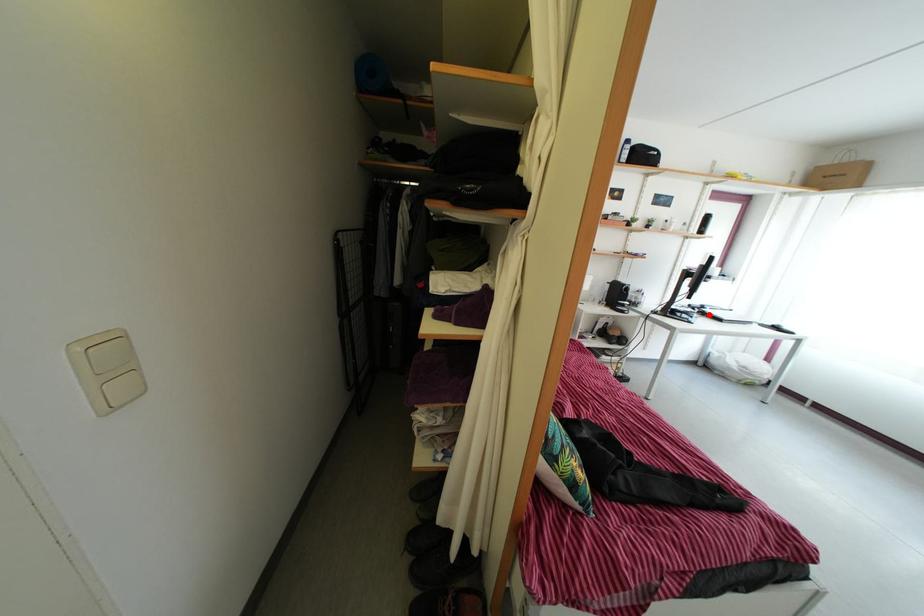
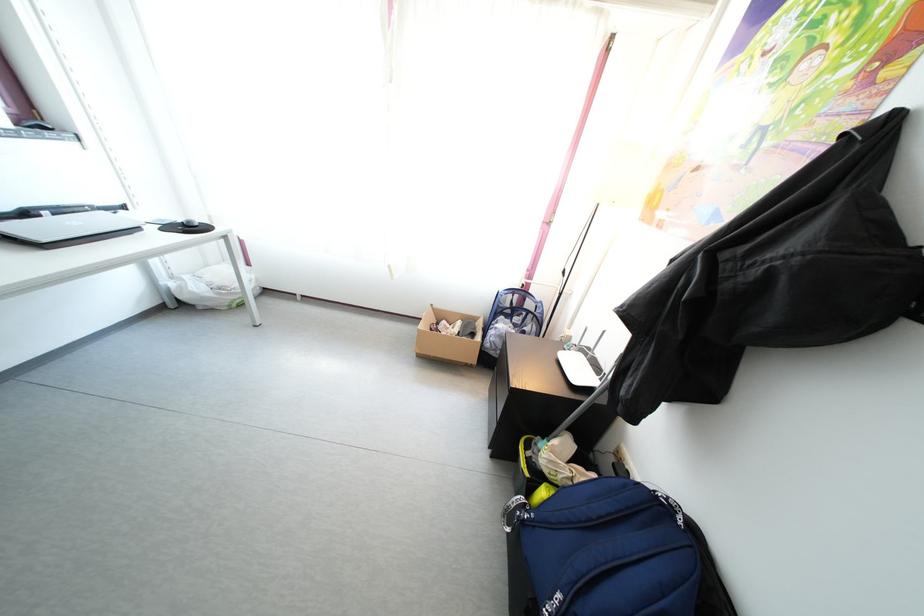
In the second image, find the point that corresponds to the highlighted location in the first image.

(31, 222)